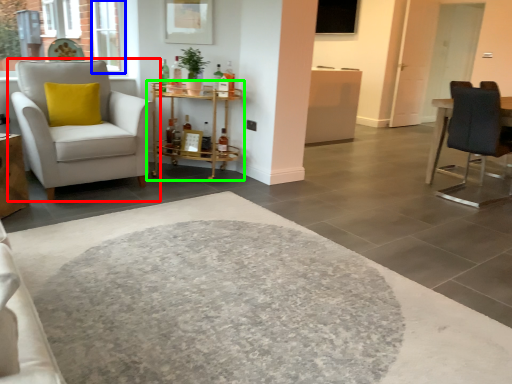
Question: Which object is positioned farthest from chair (highlighted by a red box)? Select from window (highlighted by a blue box) and table (highlighted by a green box).

Choices:
 (A) window
 (B) table

Answer: (A)